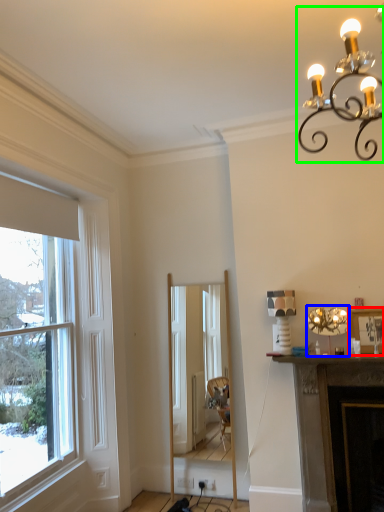
Question: Based on their relative distances, which object is farther from picture frame (highlighted by a red box)? Choose from lamp (highlighted by a blue box) and light fixture (highlighted by a green box).

Choices:
 (A) lamp
 (B) light fixture

Answer: (B)